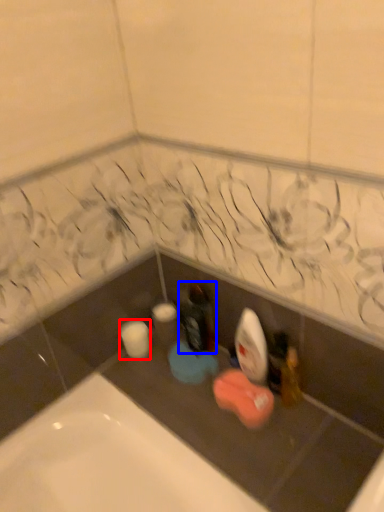
Question: Which of the following is the farthest to the observer, toilet paper (highlighted by a red box) or bottle (highlighted by a blue box)?

Choices:
 (A) toilet paper
 (B) bottle

Answer: (A)